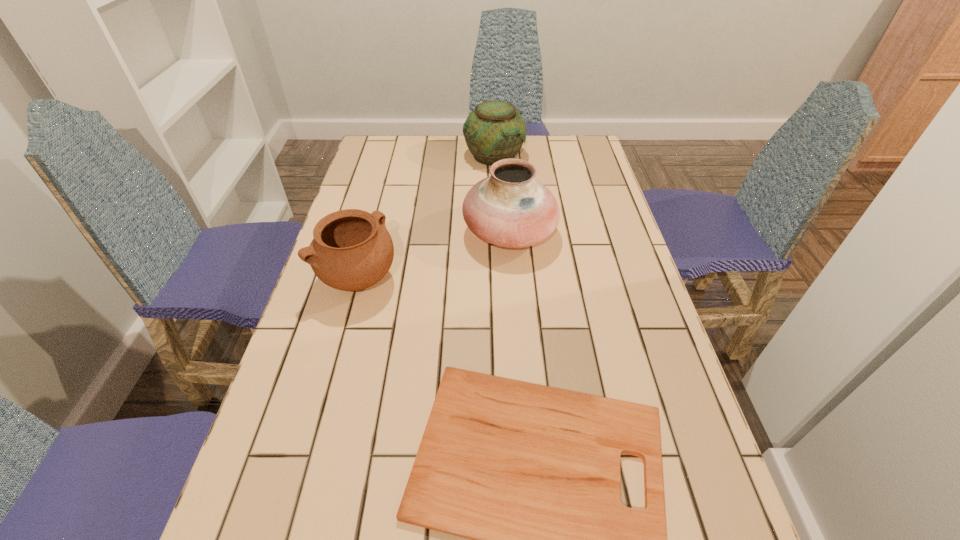
I want to click on the farthest object, so click(495, 130).

You are a GUI agent. You are given a task and a screenshot of the screen. Output one action in this format:
    pyautogui.click(x=<x>, y=<y>)
    Task: Click on the leftmost object
    This screenshot has height=540, width=960.
    Given the screenshot: What is the action you would take?
    pyautogui.click(x=352, y=250)

Where is `vacant area located on the front of the farthest pottery`? This screenshot has height=540, width=960. vacant area located on the front of the farthest pottery is located at coordinates (497, 221).

Image resolution: width=960 pixels, height=540 pixels. I want to click on vacant area situated on the back of the leftmost pottery, so click(386, 179).

Image resolution: width=960 pixels, height=540 pixels. I want to click on object that is positioned at the far edge, so click(x=495, y=130).

Identify the location of object that is at the left edge. This screenshot has width=960, height=540. (352, 250).

Locate an element on the screen. This screenshot has height=540, width=960. free space at the far edge is located at coordinates (468, 168).

You are a GUI agent. You are given a task and a screenshot of the screen. Output one action in this format:
    pyautogui.click(x=<x>, y=<y>)
    Task: Click on the free point at the left edge
    This screenshot has height=540, width=960.
    Given the screenshot: What is the action you would take?
    pyautogui.click(x=275, y=399)

In the image, there is a desktop. What are the coordinates of `vacant area at the right edge` in the screenshot? It's located at (647, 366).

Find the location of a particular element. The height and width of the screenshot is (540, 960). free spot between the farthest object and the leftmost object is located at coordinates (426, 217).